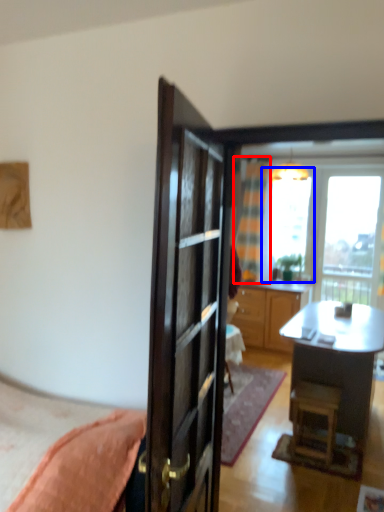
Question: Among these objects, which one is nearest to the camera, curtain (highlighted by a red box) or window screen (highlighted by a blue box)?

Choices:
 (A) curtain
 (B) window screen

Answer: (A)